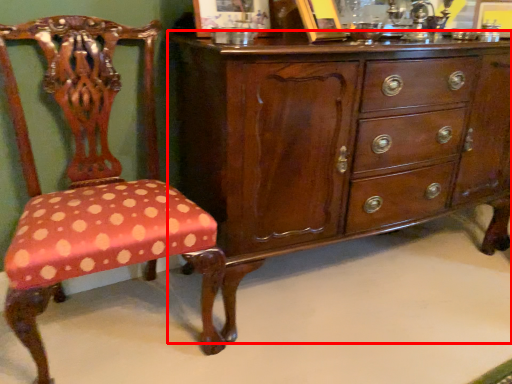
Question: In this image, where is chest of drawers (annotated by the red box) located relative to chair?

Choices:
 (A) right
 (B) left

Answer: (A)